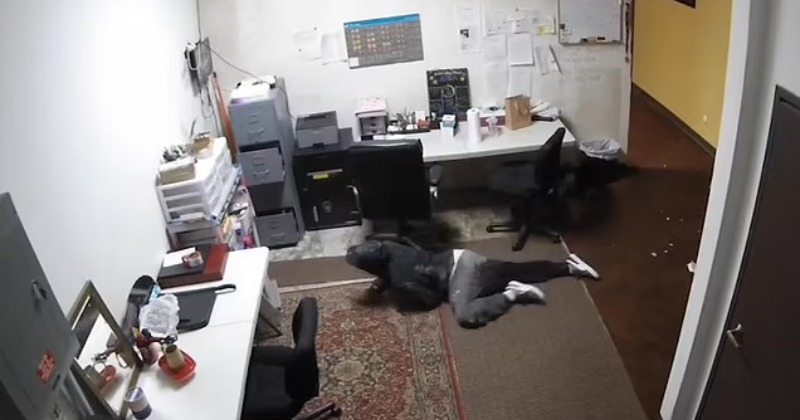
Where is `desk`? desk is located at coordinates click(228, 370), click(456, 142).